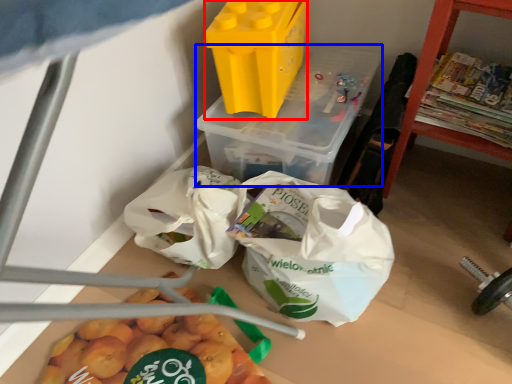
Question: Which object is further to the camera taking this photo, yoghurt (highlighted by a red box) or yoghurt (highlighted by a blue box)?

Choices:
 (A) yoghurt
 (B) yoghurt

Answer: (B)